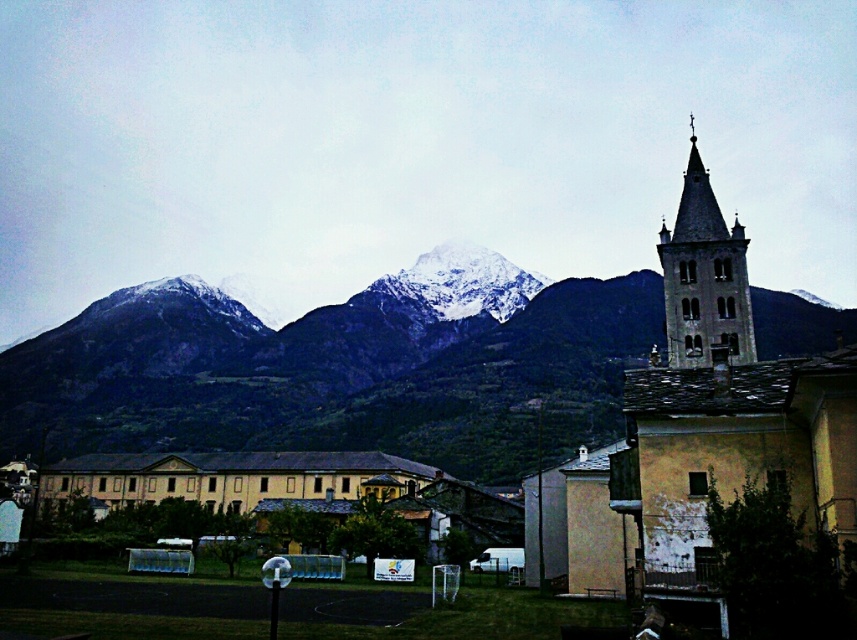
Is snowy rock mountain range at upper center positioned in front of yellow stone church at right?

No, it is behind yellow stone church at right.

Consider the image. Between snowy rock mountain range at upper center and yellow stone church at right, which one is positioned higher?

Positioned higher is snowy rock mountain range at upper center.

Is point (403, 340) closer to camera compared to point (844, 435)?

No, it is not.

This screenshot has width=857, height=640. Find the location of `snowy rock mountain range at upper center`. snowy rock mountain range at upper center is located at coordinates (334, 371).

Is yellow stone church at right positioned in front of dark gray stone bell tower at upper right?

Yes, it is in front of dark gray stone bell tower at upper right.

Measure the distance between point (652,400) and camera.

Point (652,400) and camera are 149.51 feet apart.

Image resolution: width=857 pixels, height=640 pixels. What do you see at coordinates (710, 422) in the screenshot? I see `yellow stone church at right` at bounding box center [710, 422].

The height and width of the screenshot is (640, 857). I want to click on yellow stone church at right, so click(710, 422).

Describe the element at coordinates (334, 371) in the screenshot. I see `snowy rock mountain range at upper center` at that location.

Is point (129, 401) positioned in front of point (715, 236)?

No.

I want to click on snowy rock mountain range at upper center, so click(334, 371).

The height and width of the screenshot is (640, 857). In order to click on snowy rock mountain range at upper center in this screenshot , I will do (334, 371).